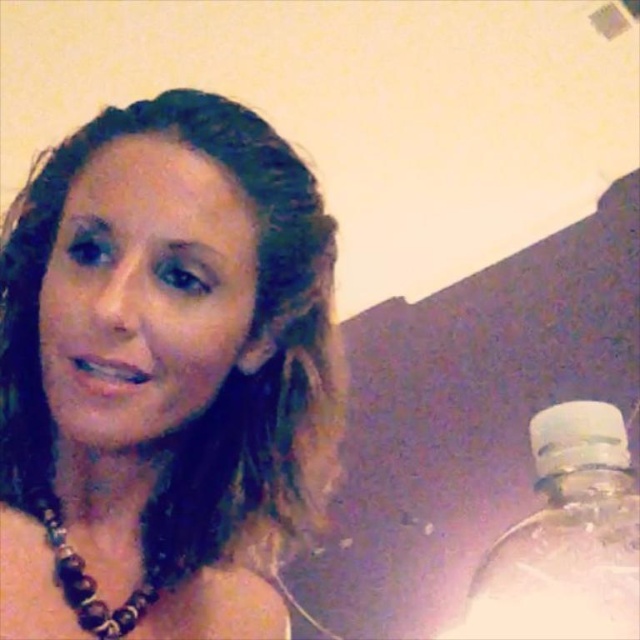
You are an interior designer assessing the placement of items in the scene. The clear plastic bottle at lower right and the brown beaded necklace at lower left are both in the foreground. Which object is closer to the viewer?

The clear plastic bottle at lower right is closer to the viewer because the brown beaded necklace at lower left is behind it.

Where is the clear plastic bottle at lower right located in the image?

The clear plastic bottle at lower right is located at point (x=566, y=536) in the image.

You are an interior designer assessing the placement of items in a room. You notice the brown beaded necklace at center and the brown beaded necklace at lower left. Which necklace is positioned higher up in the frame?

The brown beaded necklace at center is positioned higher up in the frame compared to the brown beaded necklace at lower left.